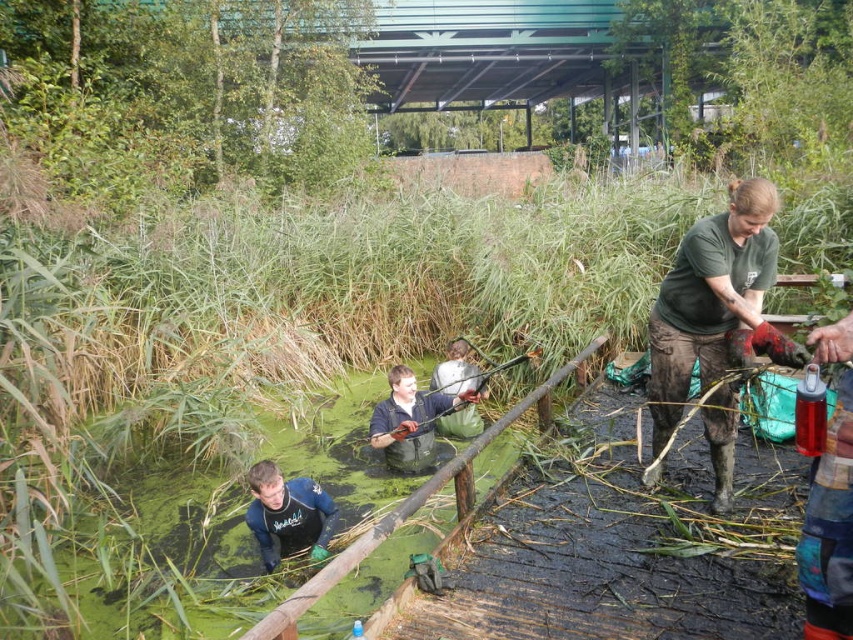
Based on the photo, you are standing at the location of the viewer in this wetland scene. There is a person wearing a green matte shirt at right. If you want to hand them a tool that requires both of you to be within 10 feet to pass it safely, can you do so without moving closer?

The green matte shirt at right and the viewer are 10.83 feet apart, which is slightly more than 10 feet. Therefore, you cannot safely pass the tool without moving closer.

You are navigating through a marshy area and need to reach a wooden platform. You see two points marked as point 1 at coordinates [672,358] and point 2 at [299,492]. According to the image, which point is closer to your current position?

Point 1 at coordinates [672,358] is in front of point 2 at [299,492], so it is closer to your current position.

You are a researcher planning to take a water sample from the murky green water in the wetland. You see the dark blue wetsuit at lower center and the dark green rubber waders at center. Which clothing item is closer to the water surface?

The dark blue wetsuit at lower center is below the dark green rubber waders at center, so the dark blue wetsuit at lower center is closer to the water surface.